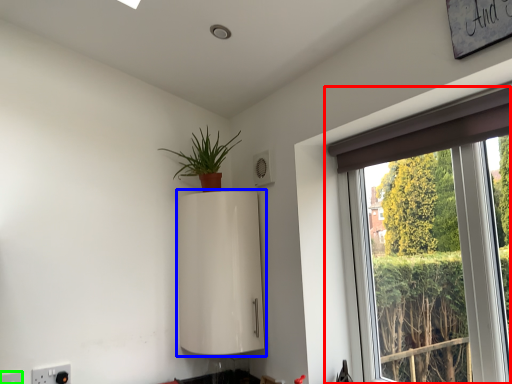
Question: Which object is the closest to the window (highlighted by a red box)? Choose among these: appliance (highlighted by a blue box) or electric outlet (highlighted by a green box).

Choices:
 (A) appliance
 (B) electric outlet

Answer: (A)